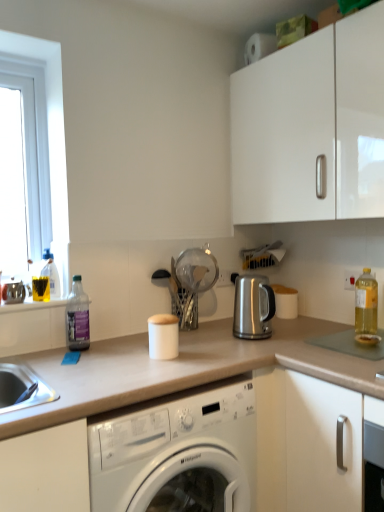
Question: From the image's perspective, would you say white glossy cabinet at upper right is shown under transparent glass strainer at center, the 2th appliance viewed from the right?

Choices:
 (A) yes
 (B) no

Answer: (B)

Question: Is white glossy cabinet at upper right turned away from transparent glass strainer at center, the 2th appliance viewed from the right?

Choices:
 (A) yes
 (B) no

Answer: (B)

Question: Can you confirm if white glossy cabinet at upper right is shorter than transparent glass strainer at center, the second appliance when ordered from left to right?

Choices:
 (A) yes
 (B) no

Answer: (B)

Question: Considering the relative sizes of white glossy cabinet at upper right and transparent glass strainer at center, the second appliance when ordered from left to right, in the image provided, is white glossy cabinet at upper right taller than transparent glass strainer at center, the second appliance when ordered from left to right,?

Choices:
 (A) yes
 (B) no

Answer: (A)

Question: Considering the relative positions of white glossy cabinet at upper right and transparent glass strainer at center, the 2th appliance viewed from the right, in the image provided, is white glossy cabinet at upper right to the left of transparent glass strainer at center, the 2th appliance viewed from the right, from the viewer's perspective?

Choices:
 (A) no
 (B) yes

Answer: (A)

Question: Is white matte canister at center, the 3th appliance positioned from the right, wider or thinner than clear plastic bottle at left, which ranks as the 2th bottle in left-to-right order?

Choices:
 (A) wide
 (B) thin

Answer: (A)

Question: From a real-world perspective, relative to clear plastic bottle at left, which ranks as the 2th bottle in left-to-right order, is white matte canister at center, the 3th appliance positioned from the right, vertically above or below?

Choices:
 (A) below
 (B) above

Answer: (A)

Question: From the image's perspective, relative to clear plastic bottle at left, which ranks as the 2th bottle in left-to-right order, is white matte canister at center, marked as the first appliance in a left-to-right arrangement, above or below?

Choices:
 (A) below
 (B) above

Answer: (A)

Question: In terms of height, does white matte canister at center, marked as the first appliance in a left-to-right arrangement, look taller or shorter compared to clear plastic bottle at left, the 2th bottle in the right-to-left sequence?

Choices:
 (A) short
 (B) tall

Answer: (A)

Question: In terms of height, does white matte canister at center, marked as the first appliance in a left-to-right arrangement, look taller or shorter compared to satin silver kettle at center, placed as the 1th appliance when sorted from right to left?

Choices:
 (A) short
 (B) tall

Answer: (A)

Question: Does point (160, 315) appear closer or farther from the camera than point (246, 279)?

Choices:
 (A) closer
 (B) farther

Answer: (A)

Question: Is white matte canister at center, marked as the first appliance in a left-to-right arrangement, wider or thinner than satin silver kettle at center, the third appliance in the left-to-right sequence?

Choices:
 (A) thin
 (B) wide

Answer: (A)

Question: From the image's perspective, is white matte canister at center, the 3th appliance positioned from the right, positioned above or below satin silver kettle at center, placed as the 1th appliance when sorted from right to left?

Choices:
 (A) above
 (B) below

Answer: (B)

Question: From a real-world perspective, relative to white matte canister at center, marked as the first appliance in a left-to-right arrangement, is satin silver kettle at center, placed as the 1th appliance when sorted from right to left, vertically above or below?

Choices:
 (A) above
 (B) below

Answer: (A)

Question: Is point (266, 282) positioned closer to the camera than point (178, 331)?

Choices:
 (A) farther
 (B) closer

Answer: (A)